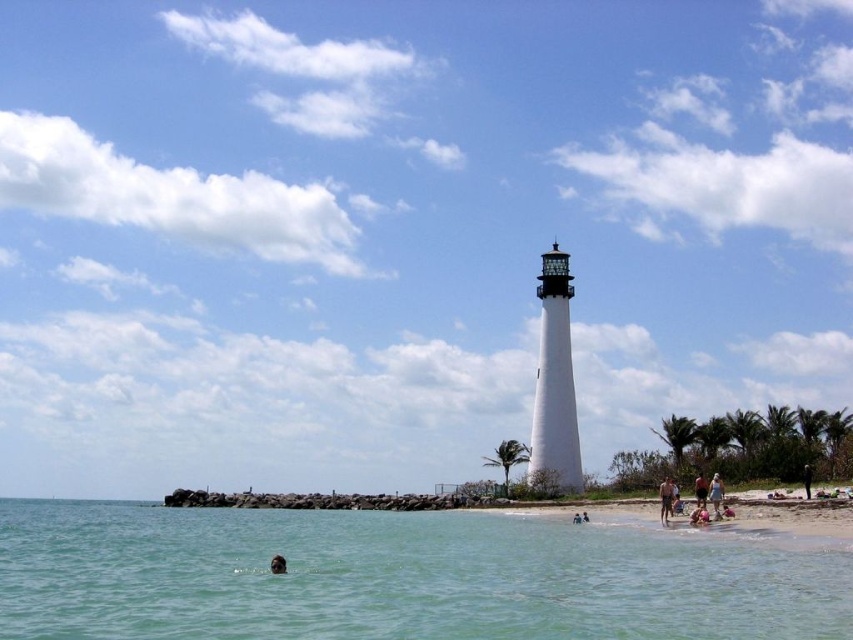
Is tan skin person at lower right taller than smooth skin face at lower center?

Correct, tan skin person at lower right is much taller as smooth skin face at lower center.

Who is taller, tan skin person at lower right or smooth skin face at lower center?

tan skin person at lower right

Does point (664, 490) come behind point (276, 561)?

Yes, point (664, 490) is farther from viewer.

Locate an element on the screen. tan skin person at lower right is located at coordinates (665, 499).

Is point (720, 497) farther from camera compared to point (701, 492)?

No, (720, 497) is closer to viewer.

Does white cotton dress at lower right appear on the right side of tan fabric shorts at lower right?

Indeed, white cotton dress at lower right is positioned on the right side of tan fabric shorts at lower right.

What do you see at coordinates (715, 493) in the screenshot?
I see `white cotton dress at lower right` at bounding box center [715, 493].

Image resolution: width=853 pixels, height=640 pixels. I want to click on white cotton dress at lower right, so click(x=715, y=493).

Who is more forward, (x=721, y=486) or (x=805, y=490)?

Positioned in front is point (x=721, y=486).

Where is `white cotton dress at lower right`? The image size is (853, 640). white cotton dress at lower right is located at coordinates (715, 493).